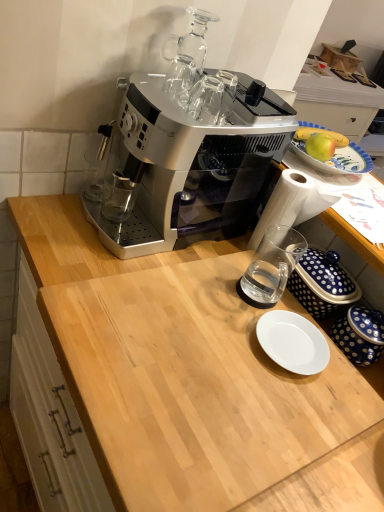
Locate an element on the screen. Image resolution: width=384 pixels, height=512 pixels. free space in front of clear glass cup at center is located at coordinates (238, 350).